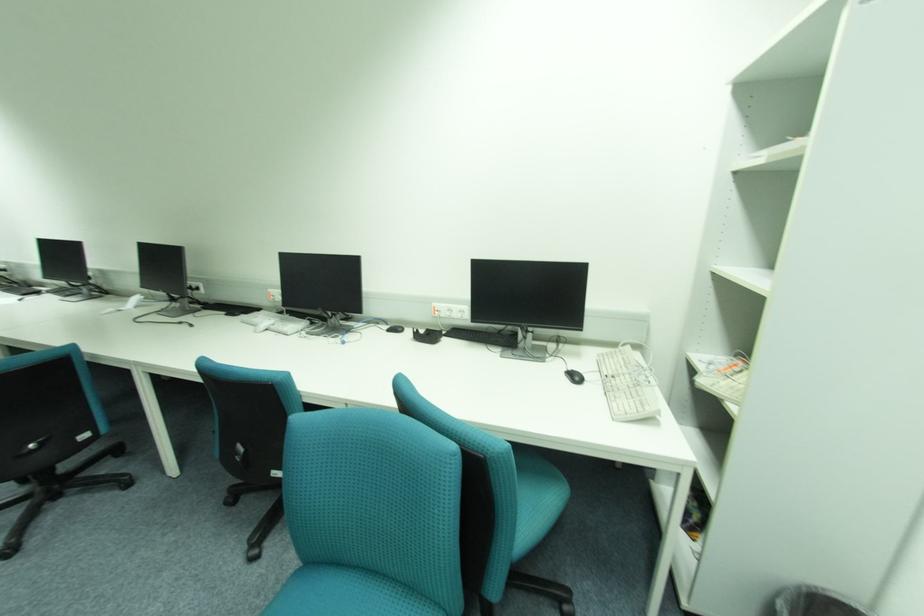
The image size is (924, 616). What are the coordinates of `black computer keyboard` in the screenshot? It's located at (483, 336).